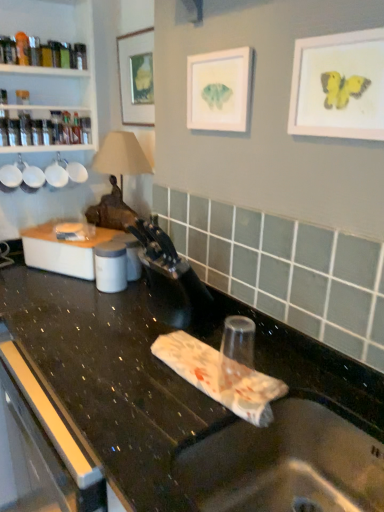
In order to click on free space in front of black plastic faucet at center in this screenshot , I will do `click(134, 349)`.